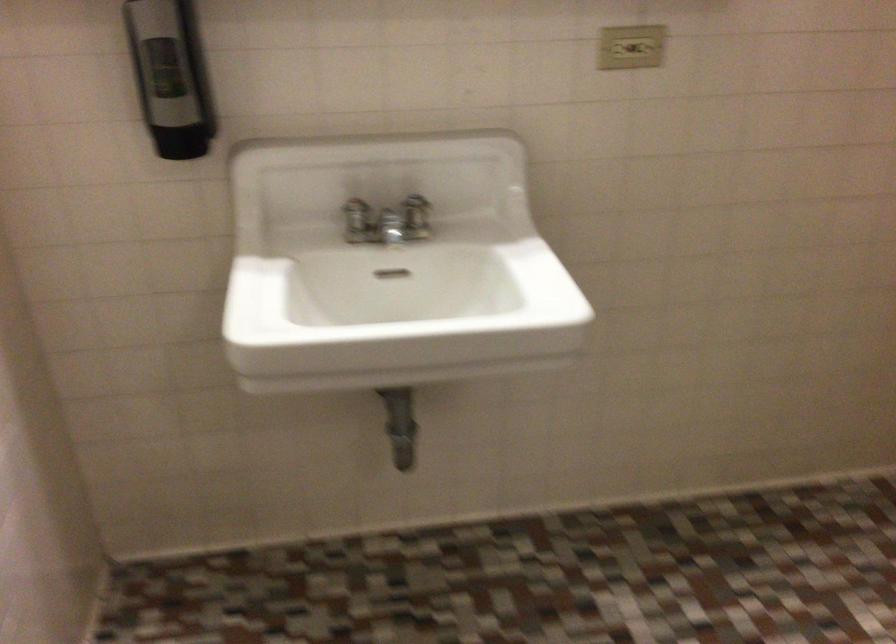
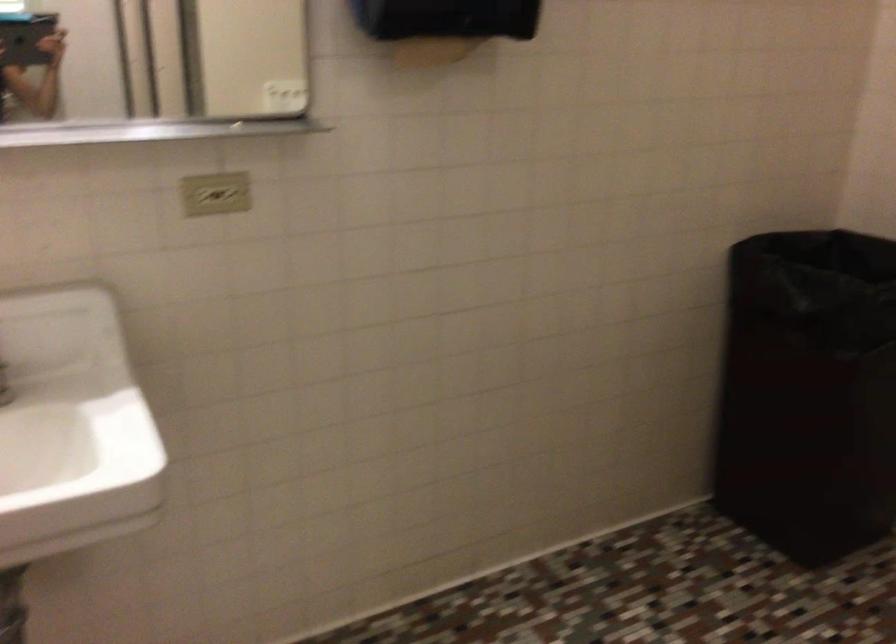
Question: Which direction would the cameraman need to move to produce the second image? Reply with the corresponding letter.

Choices:
 (A) Left
 (B) Right
 (C) Forward
 (D) Backward

Answer: (B)